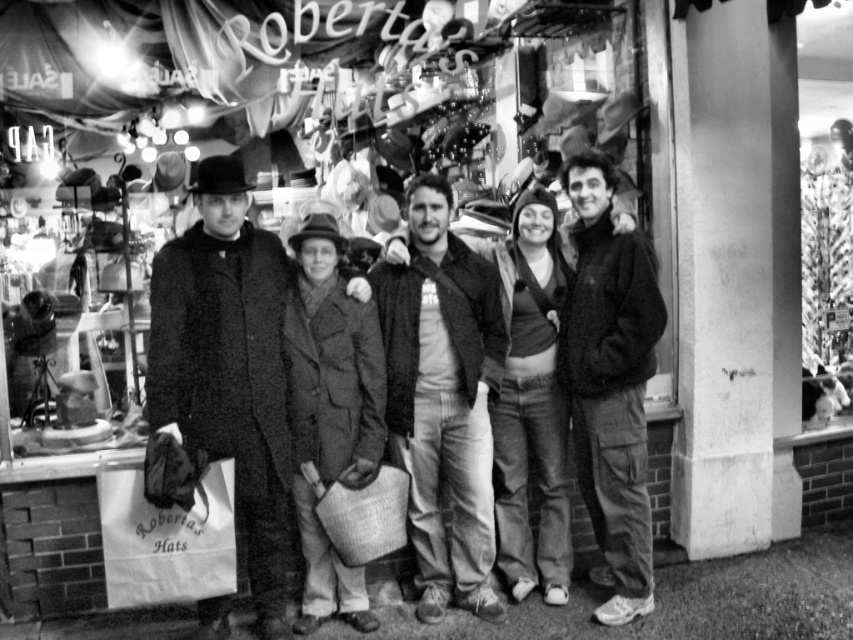
You are trying to decide which jacket to buy between the matte black jacket at center and the dark gray fleece jacket at right. Based on their sizes in the photo, which one is more suitable for someone who prefers a more compact and less bulky option?

The matte black jacket at center is smaller than the dark gray fleece jacket at right, so it would be more suitable for someone who prefers a compact and less bulky option.

You are a fashion designer observing the group in front of Robert s Hats. You notice two black outerwear items at the center of the image. Which one is taller, the smooth black coat at center or the matte black jacket at center?

The smooth black coat at center is taller than the matte black jacket at center according to the description.

You are standing in front of Robert s Hats store and want to take a photo of the point at coordinate (473,556). The camera you have can only focus on objects within 4 meters. Will the point be in focus?

The point at coordinate (473,556) is 4.10 meters away from the viewer, which is slightly beyond the camera s 4 meter focus range. The point will not be in focus.